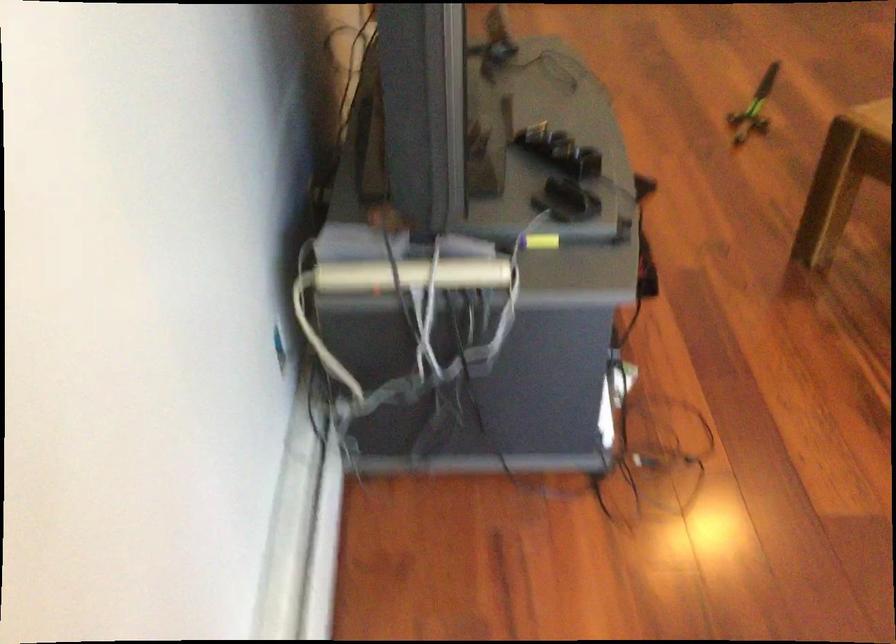
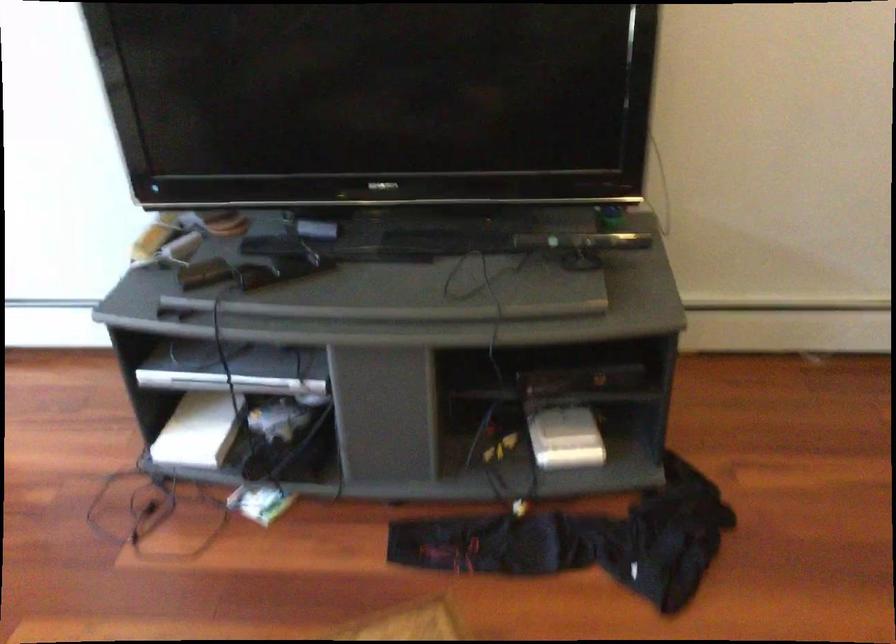
Locate, in the second image, the point that corresponds to the point at 574,377 in the first image.

(199, 430)